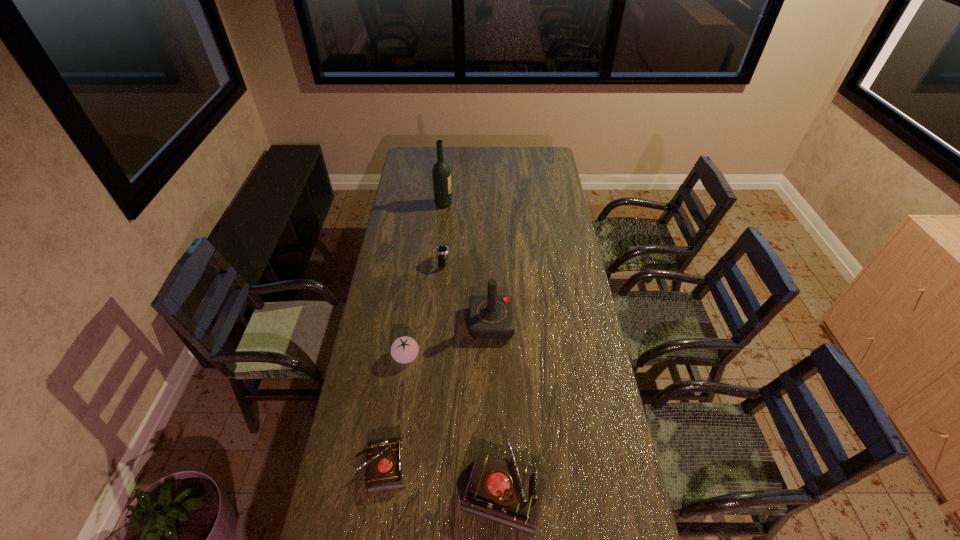
The height and width of the screenshot is (540, 960). I want to click on free space at the far edge of the desktop, so point(496,150).

Where is `vacant space at the left edge of the desktop`? The image size is (960, 540). vacant space at the left edge of the desktop is located at coordinates (397, 286).

In the image, there is a desktop. At what (x,y) coordinates should I click in order to perform the action: click on vacant space at the right edge. Please return your answer as a coordinate pair (x, y). The image size is (960, 540). Looking at the image, I should click on (558, 194).

The height and width of the screenshot is (540, 960). In order to click on free space at the far right corner in this screenshot , I will do `click(531, 154)`.

Identify the location of vacant space at the near right corner of the desktop. The width and height of the screenshot is (960, 540). (625, 499).

Find the location of a particular element. vacant space in between the right diary and the fourth farthest object is located at coordinates (455, 422).

Locate an element on the screen. The height and width of the screenshot is (540, 960). vacant area between the third farthest object and the right diary is located at coordinates (498, 405).

This screenshot has width=960, height=540. What are the coordinates of `free spot between the third nearest object and the right diary` in the screenshot? It's located at (455, 422).

Where is `empty location between the right diary and the tomato`? This screenshot has width=960, height=540. empty location between the right diary and the tomato is located at coordinates (455, 422).

Locate an element on the screen. This screenshot has width=960, height=540. vacant area that lies between the tomato and the farthest object is located at coordinates (425, 280).